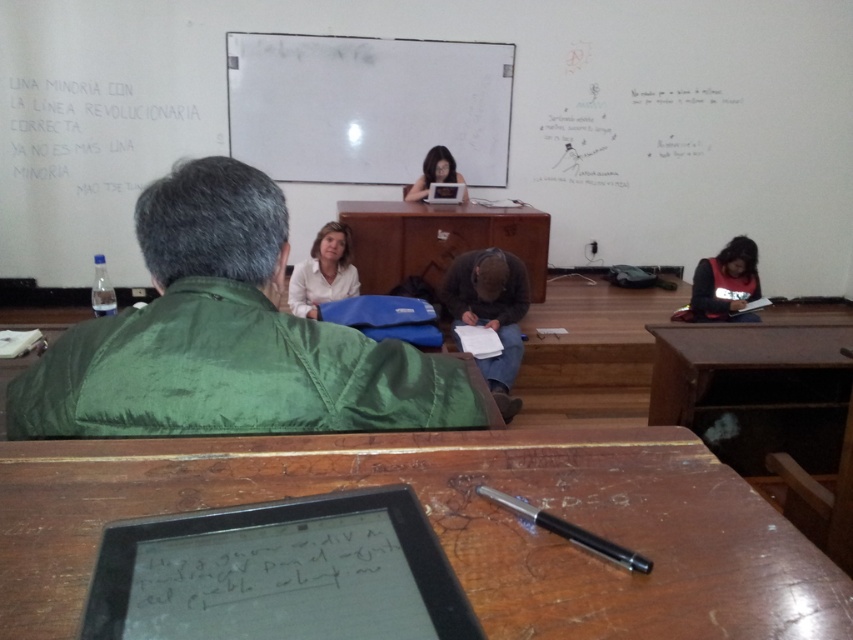
Question: Which object is farther from the camera taking this photo?

Choices:
 (A) matte black tablet at center
 (B) black metallic pen at center
 (C) white matte shirt at center

Answer: (A)

Question: Does wooden table at lower center appear under matte black tablet at center?

Choices:
 (A) yes
 (B) no

Answer: (A)

Question: Among these objects, which one is nearest to the camera?

Choices:
 (A) black metallic pen at center
 (B) white matte board at upper center
 (C) brown wooden table at center
 (D) white matte shirt at center

Answer: (A)

Question: Is white matte board at upper center to the right of brown wooden table at center from the viewer's perspective?

Choices:
 (A) no
 (B) yes

Answer: (A)

Question: Which point is farther from the camera taking this photo?

Choices:
 (A) (463, 224)
 (B) (447, 179)
 (C) (726, 298)
 (D) (256, 208)

Answer: (B)

Question: Can you confirm if wooden table at lower center is thinner than brown wooden table at center?

Choices:
 (A) no
 (B) yes

Answer: (B)